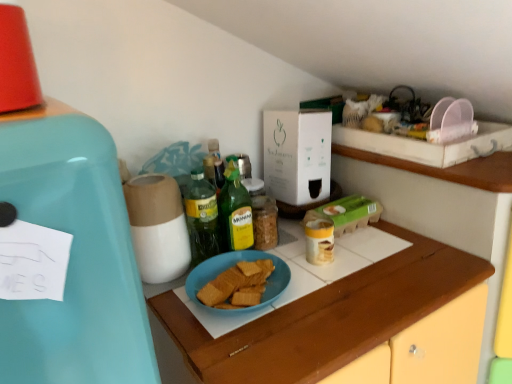
Question: Is green glass bottle at center, which is counted as the 2th bottle, starting from the right, behind blue matte plate at center?

Choices:
 (A) no
 (B) yes

Answer: (B)

Question: Is green glass bottle at center, which is counted as the 2th bottle, starting from the right, smaller than blue matte plate at center?

Choices:
 (A) no
 (B) yes

Answer: (B)

Question: From a real-world perspective, is green glass bottle at center, which is counted as the first bottle, starting from the left, below blue matte plate at center?

Choices:
 (A) no
 (B) yes

Answer: (A)

Question: Does green glass bottle at center, which is counted as the 2th bottle, starting from the right, appear on the right side of blue matte plate at center?

Choices:
 (A) yes
 (B) no

Answer: (B)

Question: Considering the relative positions of green glass bottle at center, which is counted as the 2th bottle, starting from the right, and blue matte plate at center in the image provided, is green glass bottle at center, which is counted as the 2th bottle, starting from the right, to the left of blue matte plate at center from the viewer's perspective?

Choices:
 (A) no
 (B) yes

Answer: (B)

Question: Is green glass bottle at center, which is counted as the 2th bottle, starting from the right, positioned far away from blue matte plate at center?

Choices:
 (A) no
 (B) yes

Answer: (A)

Question: Is green glass bottle at center, which is the 1th bottle from right to left, at the right side of teal matte refrigerator at left?

Choices:
 (A) yes
 (B) no

Answer: (A)

Question: Is green glass bottle at center, which is the 1th bottle from right to left, in front of teal matte refrigerator at left?

Choices:
 (A) yes
 (B) no

Answer: (B)

Question: From a real-world perspective, is green glass bottle at center, positioned as the second bottle in left-to-right order, physically above teal matte refrigerator at left?

Choices:
 (A) no
 (B) yes

Answer: (A)

Question: Does green glass bottle at center, which is the 1th bottle from right to left, have a larger size compared to teal matte refrigerator at left?

Choices:
 (A) yes
 (B) no

Answer: (B)

Question: From the image's perspective, does green glass bottle at center, positioned as the second bottle in left-to-right order, appear lower than teal matte refrigerator at left?

Choices:
 (A) yes
 (B) no

Answer: (B)

Question: Is green glass bottle at center, which is the 1th bottle from right to left, touching teal matte refrigerator at left?

Choices:
 (A) yes
 (B) no

Answer: (B)

Question: Is teal matte refrigerator at left positioned with its back to white cardboard box at center?

Choices:
 (A) yes
 (B) no

Answer: (B)